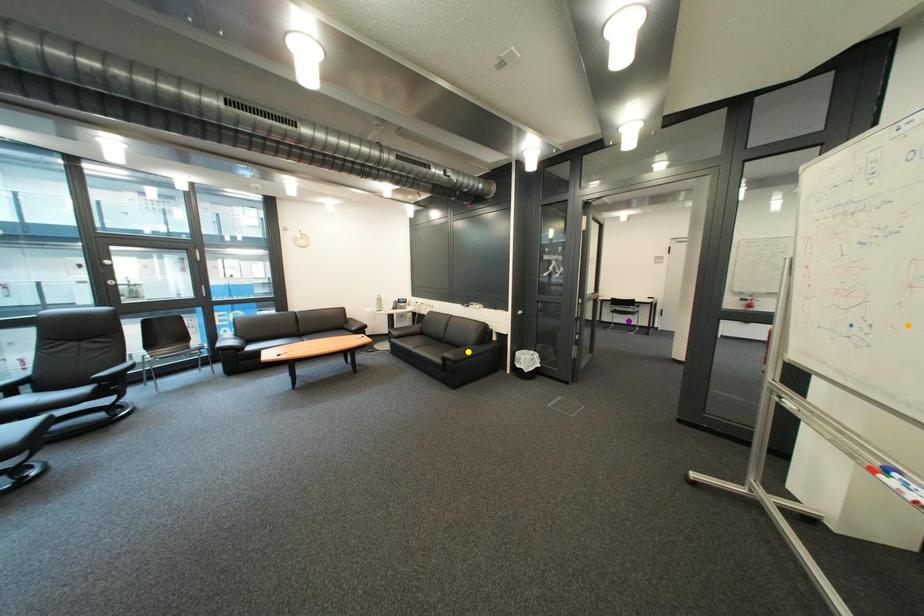
Order these from nearest to farthest:
yellow point
orange point
purple point

orange point, yellow point, purple point